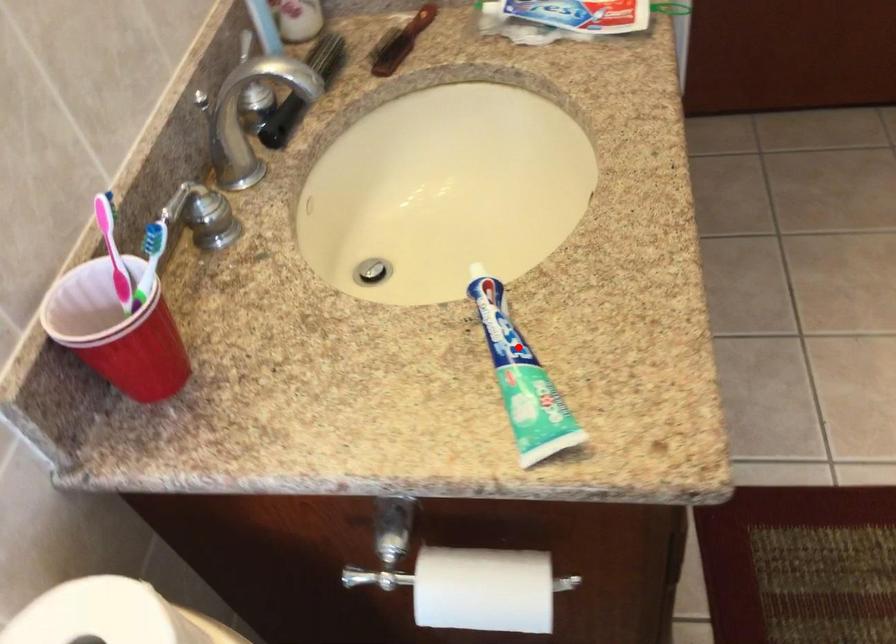
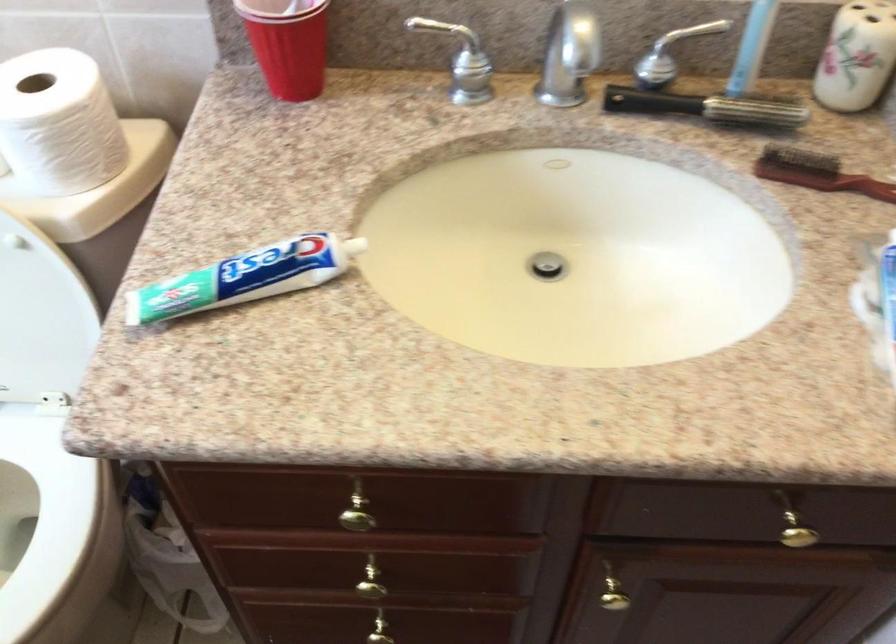
Where in the second image is the point corresponding to the highlighted location from the first image?

(245, 277)